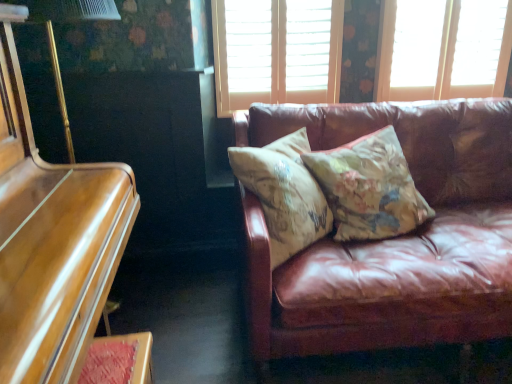
What is the approximate width of wooden blinds at upper center, the 2th window viewed from the right?

The width of wooden blinds at upper center, the 2th window viewed from the right, is 8.93 centimeters.

What do you see at coordinates (369, 187) in the screenshot? This screenshot has height=384, width=512. I see `floral-patterned fabric pillow at center, the second pillow in the left-to-right sequence` at bounding box center [369, 187].

The width and height of the screenshot is (512, 384). What do you see at coordinates (52, 239) in the screenshot? I see `shiny brown piano at left` at bounding box center [52, 239].

This screenshot has height=384, width=512. In order to click on shiny brown piano at left in this screenshot , I will do `click(52, 239)`.

Describe the element at coordinates (284, 193) in the screenshot. I see `floral-patterned fabric pillow at center, the 2th pillow when ordered from right to left` at that location.

At what (x,y) coordinates should I click in order to perform the action: click on wooden blinds at upper center, acting as the 1th window starting from the left. Please return your answer as a coordinate pair (x, y). Looking at the image, I should click on (280, 57).

Considering the sizes of objects floral-patterned fabric pillow at center, the second pillow in the left-to-right sequence, and shiny brown piano at left in the image provided, who is shorter, floral-patterned fabric pillow at center, the second pillow in the left-to-right sequence, or shiny brown piano at left?

Standing shorter between the two is floral-patterned fabric pillow at center, the second pillow in the left-to-right sequence.

From a real-world perspective, which object rests below the other?

In real-world perspective, floral-patterned fabric pillow at center, marked as the first pillow in a right-to-left arrangement, is lower.

Is floral-patterned fabric pillow at center, the second pillow in the left-to-right sequence, placed right next to shiny brown piano at left?

No, floral-patterned fabric pillow at center, the second pillow in the left-to-right sequence, is not touching shiny brown piano at left.

From the image's perspective, count 2nd pillows upward from the shiny brown piano at left and point to it. Please provide its 2D coordinates.

[(369, 187)]

What are the coordinates of `the 1st pillow in front of the wooden blinds at upper center, acting as the 1th window starting from the left, starting your count from the anchor` in the screenshot? It's located at (369, 187).

From a real-world perspective, which object rests below the other?

floral-patterned fabric pillow at center, marked as the first pillow in a right-to-left arrangement, is physically lower.

What's the angular difference between wooden blinds at upper center, acting as the 1th window starting from the left, and floral-patterned fabric pillow at center, marked as the first pillow in a right-to-left arrangement,'s facing directions?

The angle between the facing direction of wooden blinds at upper center, acting as the 1th window starting from the left, and the facing direction of floral-patterned fabric pillow at center, marked as the first pillow in a right-to-left arrangement, is 25.1 degrees.

Between wooden blinds at upper center, acting as the 1th window starting from the left, and floral-patterned fabric pillow at center, the second pillow in the left-to-right sequence, which one has larger size?

floral-patterned fabric pillow at center, the second pillow in the left-to-right sequence, is bigger.

Is matte white window at upper right, which is the second window from left to right, positioned in front of floral-patterned fabric pillow at center, which is the first pillow in left-to-right order?

That is False.

Is matte white window at upper right, which is the 1th window in right-to-left order, positioned with its back to floral-patterned fabric pillow at center, the 2th pillow when ordered from right to left?

No.

From the image's perspective, who appears lower, matte white window at upper right, which is the 1th window in right-to-left order, or floral-patterned fabric pillow at center, the 2th pillow when ordered from right to left?

floral-patterned fabric pillow at center, the 2th pillow when ordered from right to left.

Which of these two, matte white window at upper right, which is the 1th window in right-to-left order, or floral-patterned fabric pillow at center, which is the first pillow in left-to-right order, stands shorter?

floral-patterned fabric pillow at center, which is the first pillow in left-to-right order, is shorter.

From the image's perspective, between matte white window at upper right, which is the second window from left to right, and wooden blinds at upper center, acting as the 1th window starting from the left, who is located below?

wooden blinds at upper center, acting as the 1th window starting from the left, appears lower in the image.

From a real-world perspective, is matte white window at upper right, which is the second window from left to right, physically located above or below wooden blinds at upper center, the 2th window viewed from the right?

matte white window at upper right, which is the second window from left to right, is situated higher than wooden blinds at upper center, the 2th window viewed from the right, in the real world.

Is matte white window at upper right, which is the 1th window in right-to-left order, taller or shorter than wooden blinds at upper center, acting as the 1th window starting from the left?

Clearly, matte white window at upper right, which is the 1th window in right-to-left order, is shorter compared to wooden blinds at upper center, acting as the 1th window starting from the left.

From the image's perspective, is floral-patterned fabric pillow at center, the 2th pillow when ordered from right to left, below wooden blinds at upper center, acting as the 1th window starting from the left?

Yes, from the image's perspective, floral-patterned fabric pillow at center, the 2th pillow when ordered from right to left, is beneath wooden blinds at upper center, acting as the 1th window starting from the left.

Is floral-patterned fabric pillow at center, which is the first pillow in left-to-right order, inside the boundaries of wooden blinds at upper center, acting as the 1th window starting from the left, or outside?

The correct answer is: outside.

Does floral-patterned fabric pillow at center, the 2th pillow when ordered from right to left, turn towards wooden blinds at upper center, acting as the 1th window starting from the left?

No, floral-patterned fabric pillow at center, the 2th pillow when ordered from right to left, does not turn towards wooden blinds at upper center, acting as the 1th window starting from the left.

Is floral-patterned fabric pillow at center, which is the first pillow in left-to-right order, to the left or to the right of wooden blinds at upper center, acting as the 1th window starting from the left, in the image?

Based on their positions, floral-patterned fabric pillow at center, which is the first pillow in left-to-right order, is located to the right of wooden blinds at upper center, acting as the 1th window starting from the left.

Does wooden blinds at upper center, the 2th window viewed from the right, lie in front of matte white window at upper right, which is the 1th window in right-to-left order?

Yes, the depth of wooden blinds at upper center, the 2th window viewed from the right, is less than that of matte white window at upper right, which is the 1th window in right-to-left order.

Looking at this image, is wooden blinds at upper center, the 2th window viewed from the right, to the right of matte white window at upper right, which is the 1th window in right-to-left order, from the viewer's perspective?

No.

Does wooden blinds at upper center, acting as the 1th window starting from the left, have a lesser height compared to matte white window at upper right, which is the 1th window in right-to-left order?

In fact, wooden blinds at upper center, acting as the 1th window starting from the left, may be taller than matte white window at upper right, which is the 1th window in right-to-left order.

Which is closer, (339, 51) or (426, 8)?

The point (426, 8) is in front.

From the image's perspective, is matte white window at upper right, which is the second window from left to right, positioned above or below shiny brown piano at left?

From the image's perspective, matte white window at upper right, which is the second window from left to right, appears above shiny brown piano at left.

Looking at this image, can you confirm if matte white window at upper right, which is the 1th window in right-to-left order, is bigger than shiny brown piano at left?

No.

Considering the sizes of objects matte white window at upper right, which is the second window from left to right, and shiny brown piano at left in the image provided, who is thinner, matte white window at upper right, which is the second window from left to right, or shiny brown piano at left?

matte white window at upper right, which is the second window from left to right.

From a real-world perspective, between matte white window at upper right, which is the second window from left to right, and shiny brown piano at left, who is vertically lower?

shiny brown piano at left, from a real-world perspective.

Locate an element on the screen. This screenshot has width=512, height=384. the 1st pillow positioned below the shiny brown piano at left (from a real-world perspective) is located at coordinates (369, 187).

What are the coordinates of `pillow that is the 2nd one when counting rightward from the wooden blinds at upper center, acting as the 1th window starting from the left` in the screenshot? It's located at (369, 187).

When comparing their distances from floral-patterned fabric pillow at center, which is the first pillow in left-to-right order, does shiny brown piano at left or leather couch at right seem closer?

leather couch at right lies closer to floral-patterned fabric pillow at center, which is the first pillow in left-to-right order, than the other object.

Considering their positions, is shiny brown piano at left positioned closer to matte white window at upper right, which is the second window from left to right, than floral-patterned fabric pillow at center, the 2th pillow when ordered from right to left?

Based on the image, floral-patterned fabric pillow at center, the 2th pillow when ordered from right to left, appears to be nearer to matte white window at upper right, which is the second window from left to right.

Considering their positions, is wooden blinds at upper center, acting as the 1th window starting from the left, positioned closer to floral-patterned fabric pillow at center, the 2th pillow when ordered from right to left, than shiny brown piano at left?

shiny brown piano at left is closer to floral-patterned fabric pillow at center, the 2th pillow when ordered from right to left.

Looking at this image, from the image, which object appears to be farther from leather couch at right, floral-patterned fabric pillow at center, which is the first pillow in left-to-right order, or shiny brown piano at left?

Among the two, shiny brown piano at left is located further to leather couch at right.

Looking at the image, which one is located closer to leather couch at right, floral-patterned fabric pillow at center, marked as the first pillow in a right-to-left arrangement, or wooden blinds at upper center, acting as the 1th window starting from the left?

Among the two, floral-patterned fabric pillow at center, marked as the first pillow in a right-to-left arrangement, is located nearer to leather couch at right.

Which object lies nearer to the anchor point floral-patterned fabric pillow at center, which is the first pillow in left-to-right order, matte white window at upper right, which is the second window from left to right, or wooden blinds at upper center, acting as the 1th window starting from the left?

Based on the image, wooden blinds at upper center, acting as the 1th window starting from the left, appears to be nearer to floral-patterned fabric pillow at center, which is the first pillow in left-to-right order.

From the image, which object appears to be farther from shiny brown piano at left, wooden blinds at upper center, the 2th window viewed from the right, or floral-patterned fabric pillow at center, the 2th pillow when ordered from right to left?

wooden blinds at upper center, the 2th window viewed from the right, is further to shiny brown piano at left.

Considering their positions, is leather couch at right positioned closer to wooden blinds at upper center, the 2th window viewed from the right, than floral-patterned fabric pillow at center, marked as the first pillow in a right-to-left arrangement?

Among the two, floral-patterned fabric pillow at center, marked as the first pillow in a right-to-left arrangement, is located nearer to wooden blinds at upper center, the 2th window viewed from the right.

The height and width of the screenshot is (384, 512). What are the coordinates of `pillow located between floral-patterned fabric pillow at center, which is the first pillow in left-to-right order, and matte white window at upper right, which is the 1th window in right-to-left order, in the depth direction` in the screenshot? It's located at (369, 187).

Image resolution: width=512 pixels, height=384 pixels. Identify the location of studio couch between shiny brown piano at left and wooden blinds at upper center, the 2th window viewed from the right, from front to back. (391, 239).

The image size is (512, 384). I want to click on studio couch between shiny brown piano at left and matte white window at upper right, which is the 1th window in right-to-left order, in the front-back direction, so click(x=391, y=239).

I want to click on window between leather couch at right and matte white window at upper right, which is the 1th window in right-to-left order, in the front-back direction, so click(280, 57).